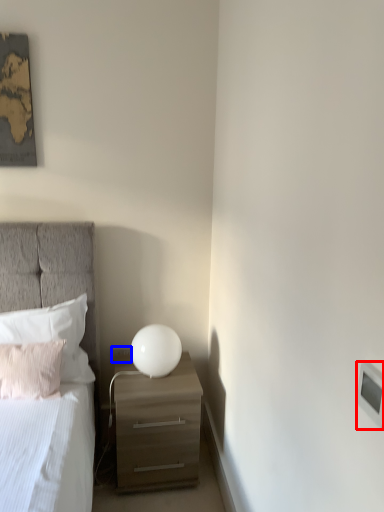
Question: Among these objects, which one is farthest to the camera, light switch (highlighted by a red box) or electric outlet (highlighted by a blue box)?

Choices:
 (A) light switch
 (B) electric outlet

Answer: (B)